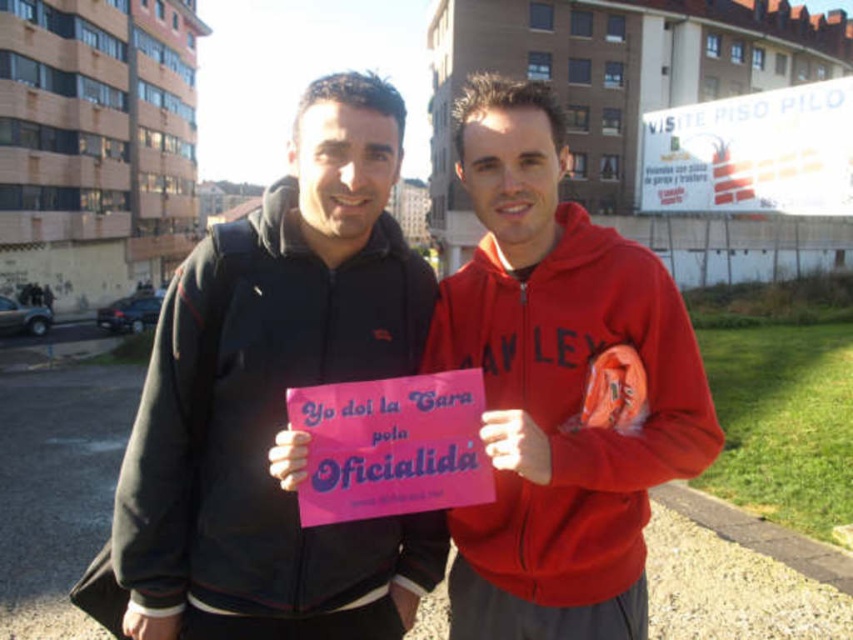
Can you confirm if pink matte sign at center is wider than white paper sign at upper right?

Incorrect, pink matte sign at center's width does not surpass white paper sign at upper right's.

What do you see at coordinates (560, 387) in the screenshot?
I see `pink matte sign at center` at bounding box center [560, 387].

Where is `pink matte sign at center`? pink matte sign at center is located at coordinates (560, 387).

Where is `pink matte sign at center`? pink matte sign at center is located at coordinates (560, 387).

Who is positioned more to the right, pink matte sign at center or matte red hoodie at center?

pink matte sign at center

Where is `pink matte sign at center`? pink matte sign at center is located at coordinates (560, 387).

Does matte black sweatshirt at center have a larger size compared to pink paper sign at center?

Yes.

What do you see at coordinates (265, 422) in the screenshot?
I see `matte black sweatshirt at center` at bounding box center [265, 422].

Find the location of a particular element. This screenshot has width=853, height=640. matte black sweatshirt at center is located at coordinates (265, 422).